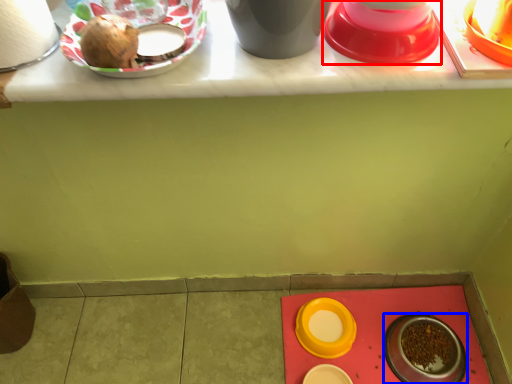
Question: Which of the following is the closest to the observer, tableware (highlighted by a red box) or tableware (highlighted by a blue box)?

Choices:
 (A) tableware
 (B) tableware

Answer: (A)